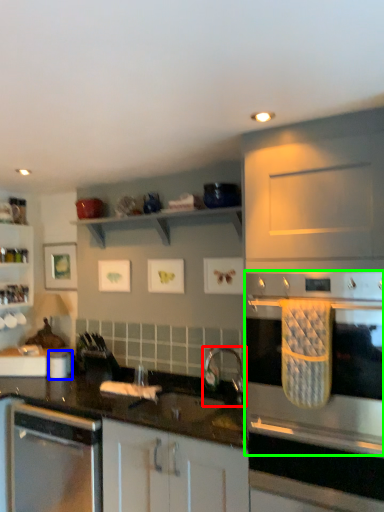
Question: Estimate the real-world distances between objects in this image. Which object is closer to tap (highlighted by a red box), appliance (highlighted by a blue box) or home appliance (highlighted by a green box)?

Choices:
 (A) appliance
 (B) home appliance

Answer: (B)